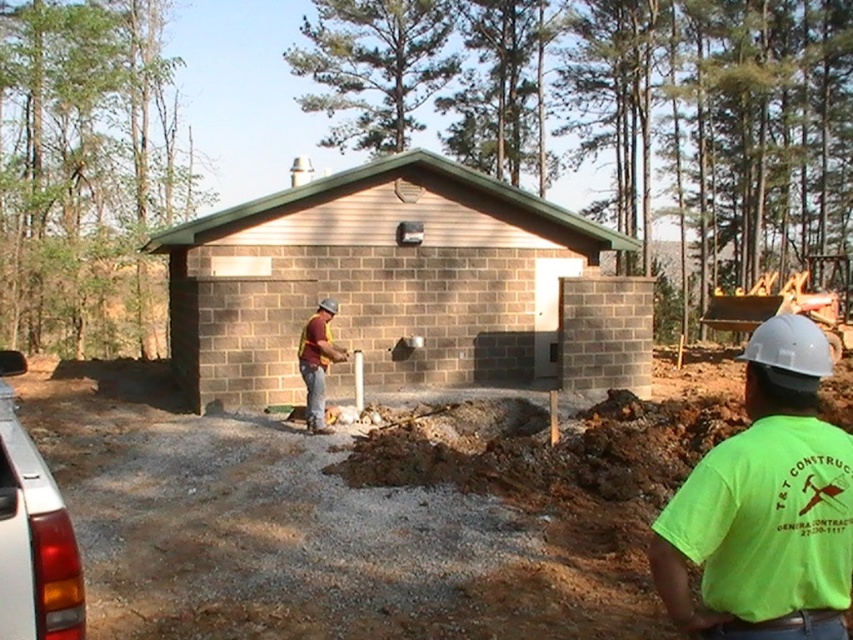
Does neon green t-shirt at center have a lesser width compared to maroon fabric shirt at center?

Yes.

Does neon green t-shirt at center appear on the left side of maroon fabric shirt at center?

In fact, neon green t-shirt at center is to the right of maroon fabric shirt at center.

Does point (840, 456) lie in front of point (305, 413)?

That is True.

This screenshot has height=640, width=853. Find the location of `neon green t-shirt at center`. neon green t-shirt at center is located at coordinates (764, 506).

Does brown brick building at center have a greater width compared to maroon fabric shirt at center?

Incorrect, brown brick building at center's width does not surpass maroon fabric shirt at center's.

You are a GUI agent. You are given a task and a screenshot of the screen. Output one action in this format:
    pyautogui.click(x=<x>, y=<y>)
    Task: Click on the brown brick building at center
    
    Given the screenshot: What is the action you would take?
    pyautogui.click(x=375, y=280)

Locate an element on the screen. The width and height of the screenshot is (853, 640). brown brick building at center is located at coordinates (375, 280).

Where is `brown brick building at center`? This screenshot has height=640, width=853. brown brick building at center is located at coordinates (375, 280).

Is brown brick building at center taller than brown fabric safety vest at center?

No, brown brick building at center is not taller than brown fabric safety vest at center.

Is point (253, 333) in front of point (326, 324)?

No, it is not.

I want to click on brown brick building at center, so click(375, 280).